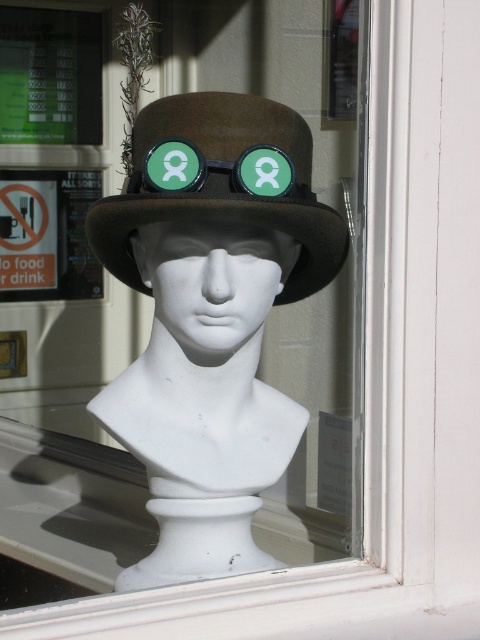
You are a customer in a gift shop and want to buy both the brown felt hat at center and the green matte goggles at center. The store has a special offer where if the distance between the two items is less than 2 inches, you get a 10 discount. Will you qualify for the discount?

The brown felt hat at center and green matte goggles at center are 1.86 inches apart from each other, which is less than 2 inches. Therefore, you qualify for the 10 discount.

You are a delivery robot that needs to place a small package at the location of point (175,310) and point (211,172). However, you can only place the package on the surface that is in front of the other point. Which point should you choose?

Point (211,172) is in front of point (175,310), so you should place the package at point (211,172).

You are a delivery person trying to place a package in the shop window. The package must be placed exactly at point (212,282). What object is currently at that location?

The white matte bust at center is located at point (212,282).